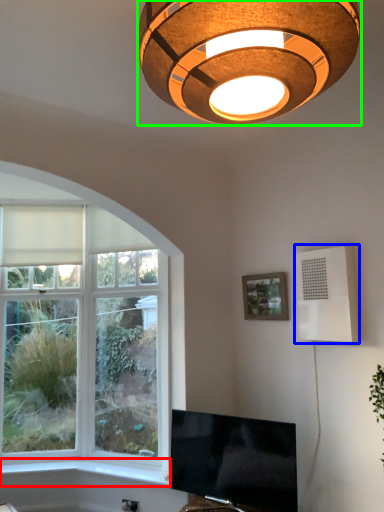
Question: Which object is the closest to the window sill (highlighted by a red box)? Choose among these: air conditioning (highlighted by a blue box) or lamp (highlighted by a green box).

Choices:
 (A) air conditioning
 (B) lamp

Answer: (A)